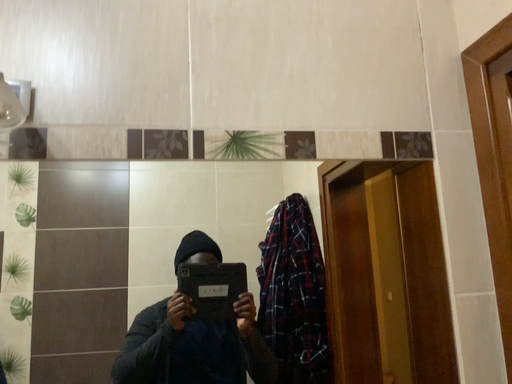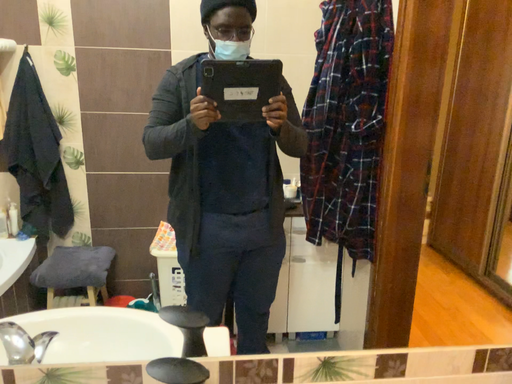
Question: How did the camera likely rotate when shooting the video?

Choices:
 (A) rotated upward
 (B) rotated downward

Answer: (B)